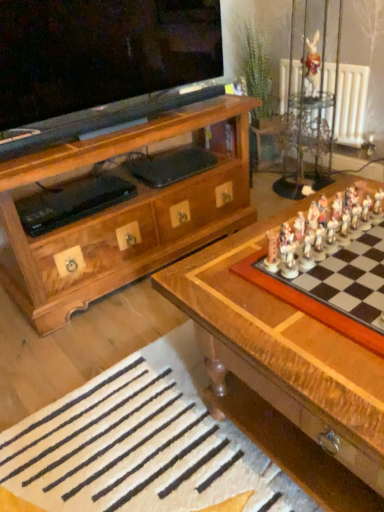
In order to click on free space on the front side of clear glass vase at upper right in this screenshot , I will do `click(287, 198)`.